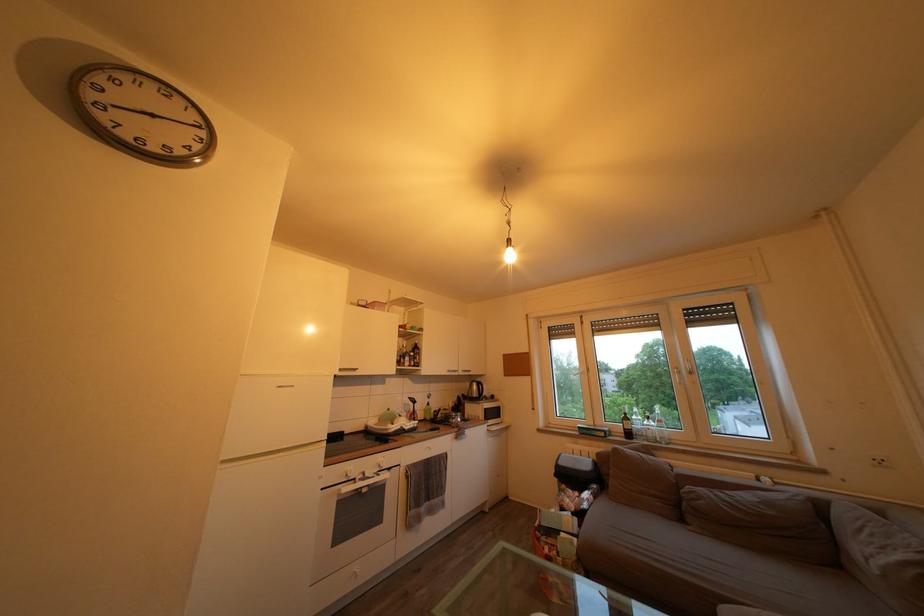
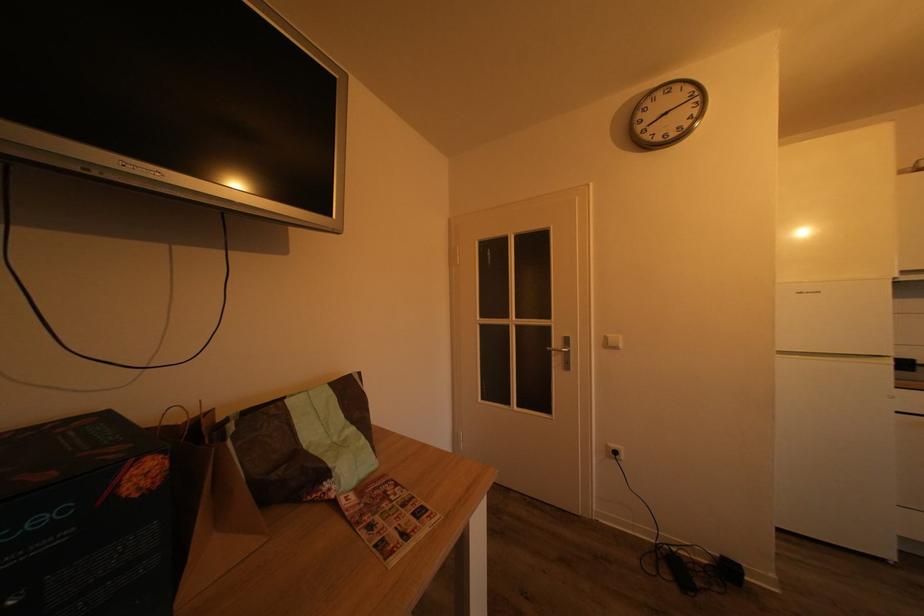
Question: The images are taken continuously from a first-person perspective. In which direction is your viewpoint rotating?

Choices:
 (A) Left
 (B) Right
 (C) Up
 (D) Down

Answer: (A)